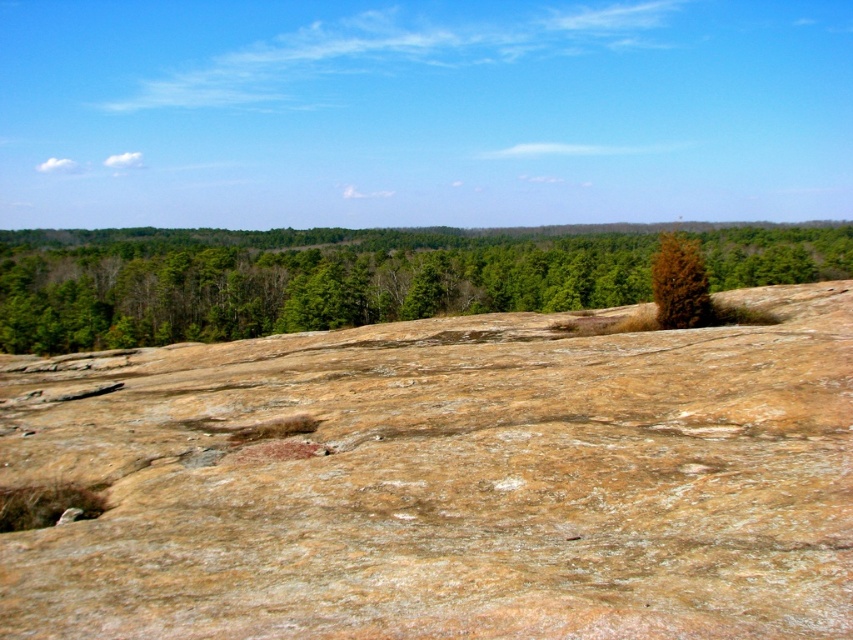
You are a hiker trying to navigate through the rocky terrain. You see a green leafy tree at center and a brown textured tree at upper right. Which tree would you choose as a landmark for orientation, and why?

You should choose the green leafy tree at center as a landmark because it is bigger than the brown textured tree at upper right, making it more visible and easier to identify from a distance.